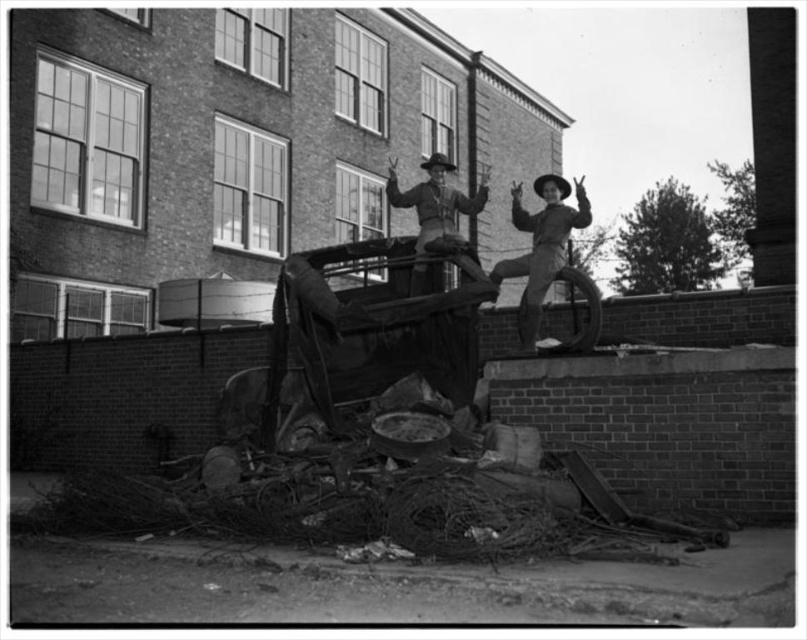
Can you confirm if matte black cowboy hat at upper right is smaller than matte leather cowboy hat at center?

No.

Consider the image. Is matte black cowboy hat at upper right taller than matte leather cowboy hat at center?

Indeed, matte black cowboy hat at upper right has a greater height compared to matte leather cowboy hat at center.

The width and height of the screenshot is (807, 640). I want to click on matte black cowboy hat at upper right, so click(x=541, y=246).

What are the coordinates of `matte black cowboy hat at upper right` in the screenshot? It's located at (541, 246).

What do you see at coordinates (358, 490) in the screenshot? This screenshot has height=640, width=807. I see `rusty metal debris at lower center` at bounding box center [358, 490].

Where is `rusty metal debris at lower center`? The width and height of the screenshot is (807, 640). rusty metal debris at lower center is located at coordinates (358, 490).

Can you confirm if rusty metal debris at lower center is bigger than matte black cowboy hat at upper right?

Incorrect, rusty metal debris at lower center is not larger than matte black cowboy hat at upper right.

Find the location of a particular element. This screenshot has width=807, height=640. rusty metal debris at lower center is located at coordinates (358, 490).

Find the location of `rusty metal debris at lower center`. rusty metal debris at lower center is located at coordinates (358, 490).